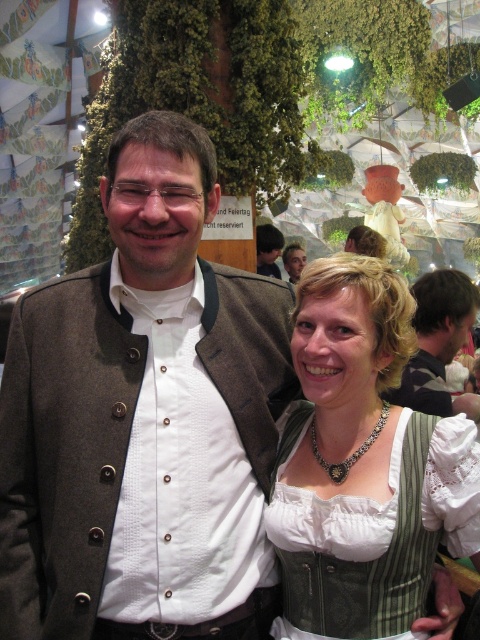
Is green plaid dirndl at center to the left of brown wool jacket at center from the viewer's perspective?

In fact, green plaid dirndl at center is to the right of brown wool jacket at center.

Is green plaid dirndl at center smaller than brown wool jacket at center?

Indeed, green plaid dirndl at center has a smaller size compared to brown wool jacket at center.

The image size is (480, 640). What do you see at coordinates (362, 465) in the screenshot?
I see `green plaid dirndl at center` at bounding box center [362, 465].

What are the coordinates of `green plaid dirndl at center` in the screenshot? It's located at (362, 465).

Image resolution: width=480 pixels, height=640 pixels. What do you see at coordinates (362, 465) in the screenshot?
I see `green plaid dirndl at center` at bounding box center [362, 465].

How distant is green plaid dirndl at center from matte brown jacket at center?

A distance of 17.10 feet exists between green plaid dirndl at center and matte brown jacket at center.

Measure the distance between point (444, 496) and camera.

A distance of 5.38 feet exists between point (444, 496) and camera.

Locate an element on the screen. green plaid dirndl at center is located at coordinates click(362, 465).

Is point (416, 605) behind point (424, 324)?

That is False.

Consider the image. Is green plaid dirndl at center closer to camera compared to dark brown leather jacket at center?

Yes, green plaid dirndl at center is closer to the viewer.

Measure the distance between point (287, 451) and camera.

A distance of 1.93 meters exists between point (287, 451) and camera.

The width and height of the screenshot is (480, 640). What are the coordinates of `green plaid dirndl at center` in the screenshot? It's located at (362, 465).